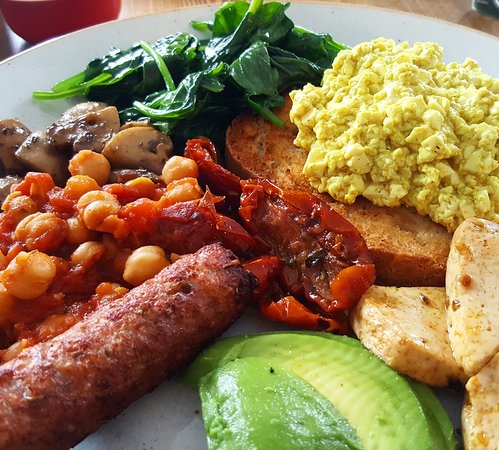
Identify the location of plate. This screenshot has height=450, width=499. (150, 413).